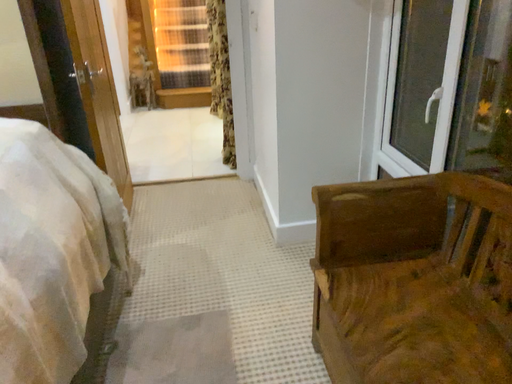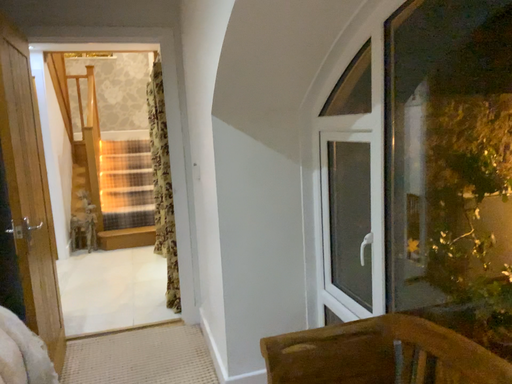
Question: How did the camera likely rotate when shooting the video?

Choices:
 (A) rotated right
 (B) rotated left

Answer: (A)